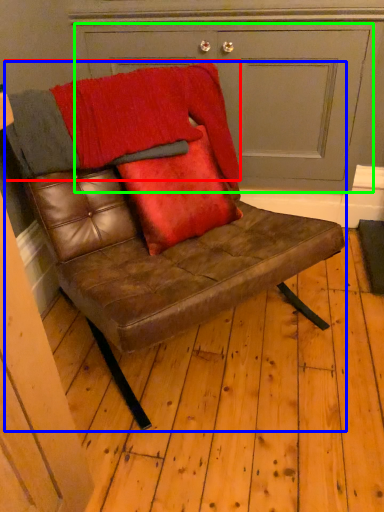
Question: Which object is the closest to the blanket (highlighted by a red box)? Choose among these: chair (highlighted by a blue box) or door (highlighted by a green box).

Choices:
 (A) chair
 (B) door

Answer: (A)